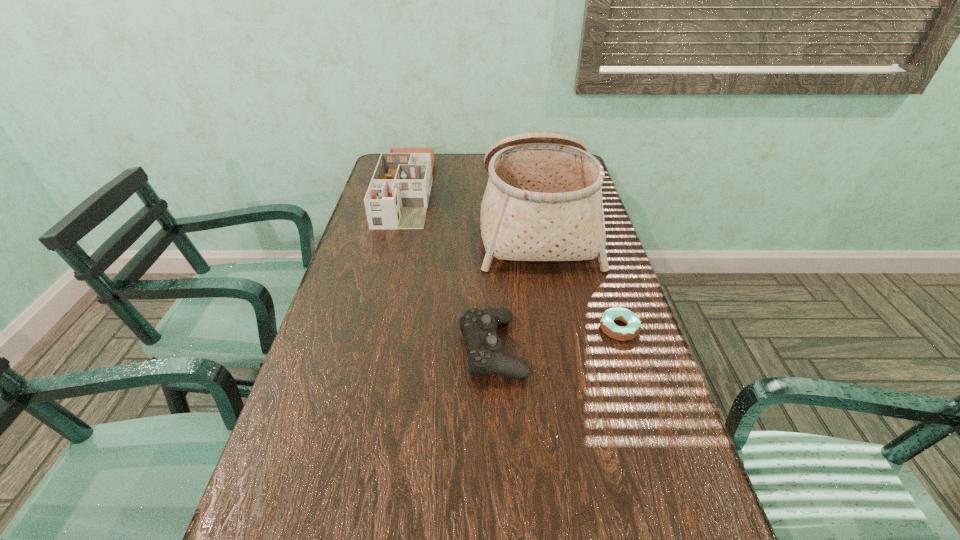
Locate an element on the screen. The width and height of the screenshot is (960, 540). free point that satisfies the following two spatial constraints: 1. with the lid open on the doughnut; 2. on the right side of the basket is located at coordinates [555, 328].

Find the location of `vacant space that satisfies the following two spatial constraints: 1. with the lid open on the basket; 2. on the back side of the doughnut`. vacant space that satisfies the following two spatial constraints: 1. with the lid open on the basket; 2. on the back side of the doughnut is located at coordinates (555, 328).

Identify the location of vacant space that satisfies the following two spatial constraints: 1. at the front door of the second tallest object; 2. on the left side of the third tallest object. (368, 348).

Where is `vacant point that satisfies the following two spatial constraints: 1. with the lid open on the basket; 2. on the back side of the shortest object`? vacant point that satisfies the following two spatial constraints: 1. with the lid open on the basket; 2. on the back side of the shortest object is located at coordinates (555, 328).

Find the location of a particular element. free space that satisfies the following two spatial constraints: 1. with the lid open on the shortest object; 2. on the left side of the tallest object is located at coordinates (555, 328).

The height and width of the screenshot is (540, 960). Identify the location of vacant region that satisfies the following two spatial constraints: 1. on the back side of the shortest object; 2. with the lid open on the basket. (586, 223).